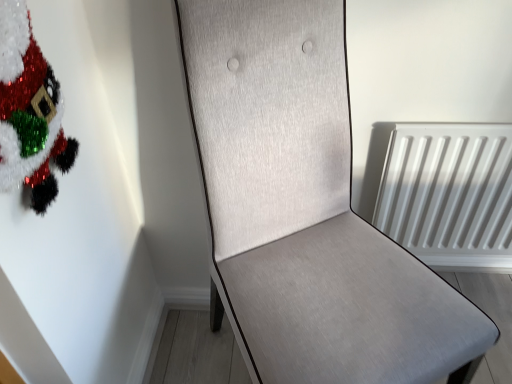
Question: Can you confirm if light gray fabric chair at center is shorter than fuzzy tinsel santa at upper left?

Choices:
 (A) no
 (B) yes

Answer: (A)

Question: Is light gray fabric chair at center positioned behind fuzzy tinsel santa at upper left?

Choices:
 (A) yes
 (B) no

Answer: (B)

Question: Would you say light gray fabric chair at center is outside fuzzy tinsel santa at upper left?

Choices:
 (A) no
 (B) yes

Answer: (B)

Question: Is light gray fabric chair at center looking in the opposite direction of fuzzy tinsel santa at upper left?

Choices:
 (A) no
 (B) yes

Answer: (A)

Question: Can you confirm if light gray fabric chair at center is smaller than fuzzy tinsel santa at upper left?

Choices:
 (A) no
 (B) yes

Answer: (A)

Question: Can you confirm if light gray fabric chair at center is taller than fuzzy tinsel santa at upper left?

Choices:
 (A) yes
 (B) no

Answer: (A)

Question: Is fuzzy tinsel santa at upper left far from light gray fabric chair at center?

Choices:
 (A) yes
 (B) no

Answer: (B)

Question: Can you confirm if fuzzy tinsel santa at upper left is thinner than light gray fabric chair at center?

Choices:
 (A) no
 (B) yes

Answer: (B)

Question: Considering the relative positions of fuzzy tinsel santa at upper left and light gray fabric chair at center in the image provided, is fuzzy tinsel santa at upper left to the right of light gray fabric chair at center from the viewer's perspective?

Choices:
 (A) yes
 (B) no

Answer: (B)

Question: Could you tell me if fuzzy tinsel santa at upper left is turned towards light gray fabric chair at center?

Choices:
 (A) no
 (B) yes

Answer: (B)

Question: Does fuzzy tinsel santa at upper left lie in front of light gray fabric chair at center?

Choices:
 (A) no
 (B) yes

Answer: (A)

Question: Can you confirm if fuzzy tinsel santa at upper left is shorter than light gray fabric chair at center?

Choices:
 (A) yes
 (B) no

Answer: (A)

Question: From a real-world perspective, is fuzzy tinsel santa at upper left physically located above or below light gray fabric chair at center?

Choices:
 (A) below
 (B) above

Answer: (B)